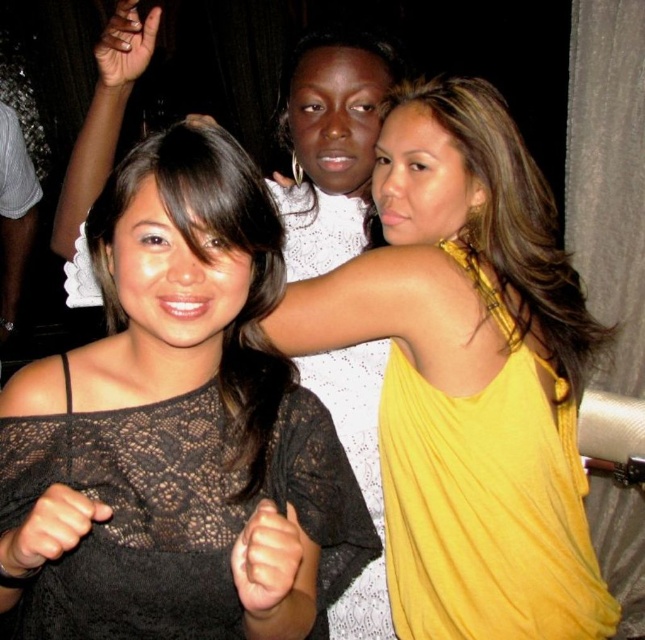
You are organizing a photoshoot and need to arrange two dresses in a display case. The case has a width of 1.2 meters. The yellow silky dress at upper right and the white lace dress at center are both to be displayed side by side. Given their sizes, will they fit comfortably in the case without overlapping?

The yellow silky dress at upper right has a larger width than the white lace dress at center. Since the combined width of both dresses would exceed the 1.2 meter display case, they might not fit comfortably without overlapping.

In the party scene, there are three people. The first is wearing a black lace top on the left, the second has a white patterned top in the center, and the third is wearing a yellow satin dress at center. Which of these three is positioned at the exact coordinates point 0.588, 0.729?

The yellow satin dress at center is positioned at point (470, 376).